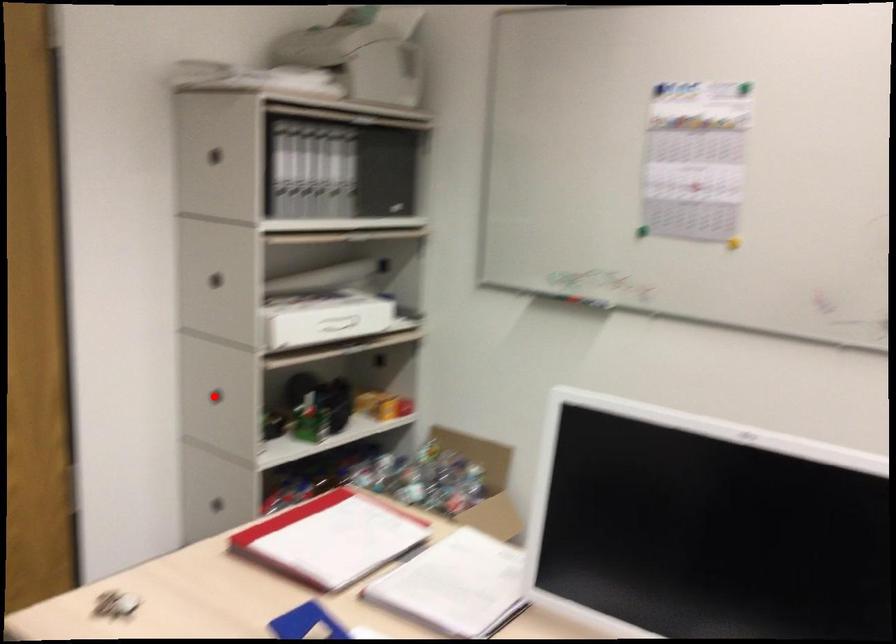
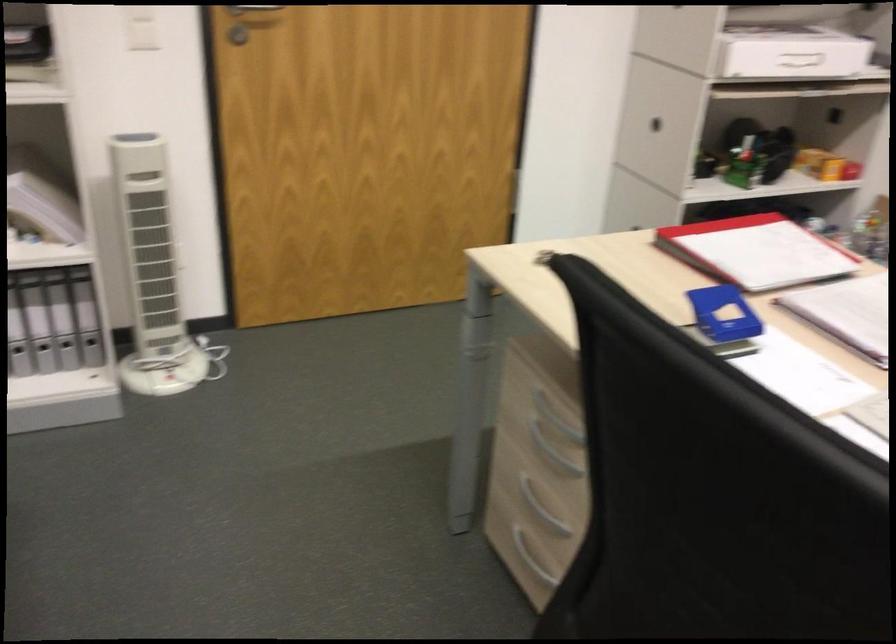
Locate, in the second image, the point that corresponds to the highlighted location in the first image.

(655, 124)